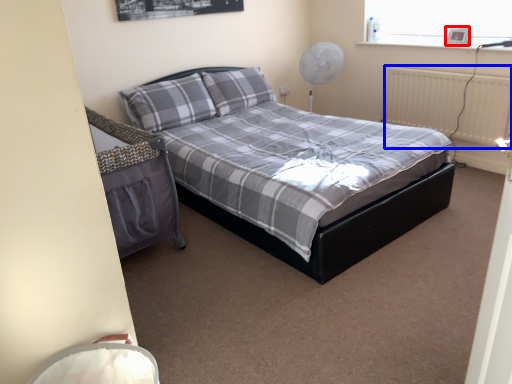
Question: Which object is further to the camera taking this photo, picture frame (highlighted by a red box) or radiator (highlighted by a blue box)?

Choices:
 (A) picture frame
 (B) radiator

Answer: (A)